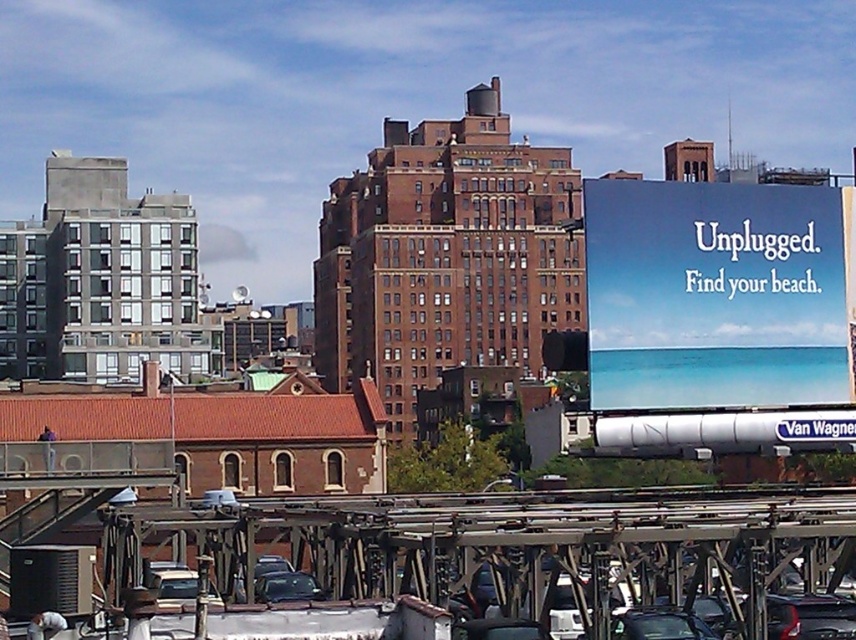
You are a delivery driver who needs to pass under the metallic gray overpass at lower center while carrying a tall load. The blue glossy billboard at upper right is nearby. Given their sizes, which object might pose a height restriction concern for your vehicle?

The metallic gray overpass at lower center has a larger size compared to the blue glossy billboard at upper right, so the metallic gray overpass at lower center is more likely to pose a height restriction concern for your vehicle since it is larger and could have lower clearance.

You are a delivery person trying to park your truck, which is 2.5 meters wide, in the parking structure. You see a shiny black sedan at center and a shiny black car at center. Which vehicle should you avoid parking next to to ensure enough space?

The shiny black sedan at center might be wider than the shiny black car at center, so you should avoid parking next to the shiny black sedan at center to ensure there is enough space for your truck.